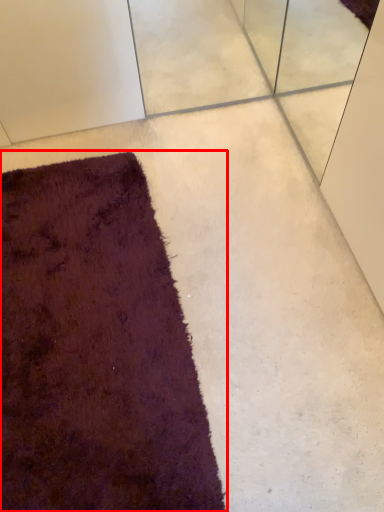
Question: In this image, where is towel (annotated by the red box) located relative to concrete?

Choices:
 (A) left
 (B) right

Answer: (A)